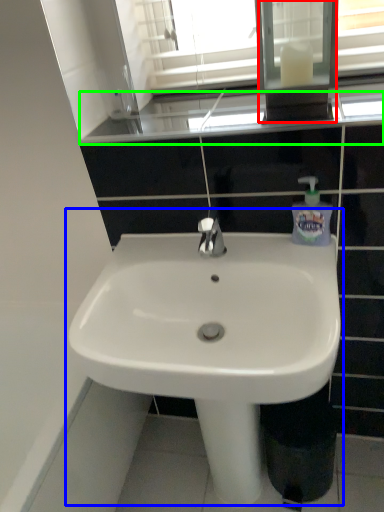
Question: Considering the real-world distances, which object is farthest from medicine cabinet (highlighted by a red box)? sink (highlighted by a blue box) or window sill (highlighted by a green box)?

Choices:
 (A) sink
 (B) window sill

Answer: (A)